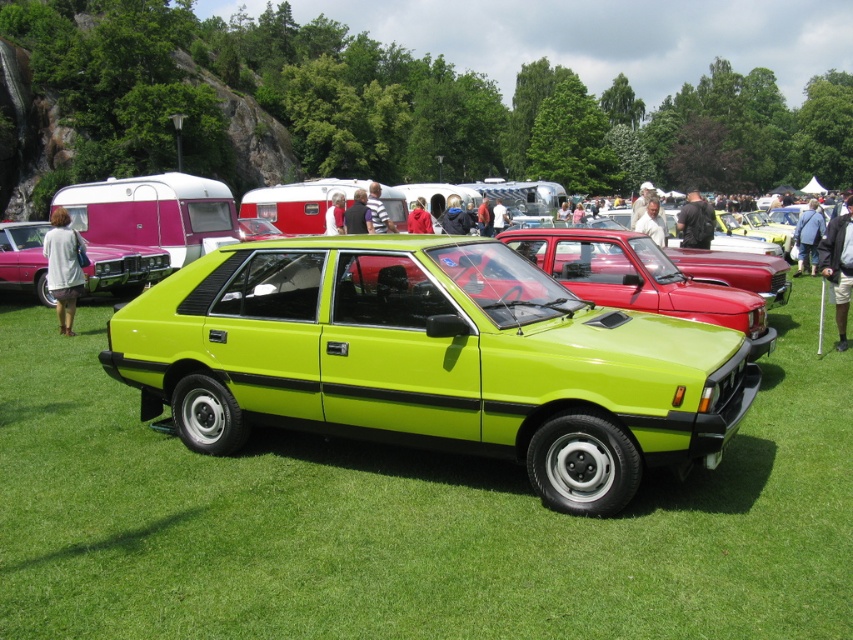
You are a photographer at the car show and want to take a photo of the lime green plastic car at center and the matte pink car at left. Do you need to adjust your position so both cars are fully visible in the frame?

The lime green plastic car at center is in front of the matte pink car at left, so you will need to adjust your position to ensure both cars are fully visible in the frame.